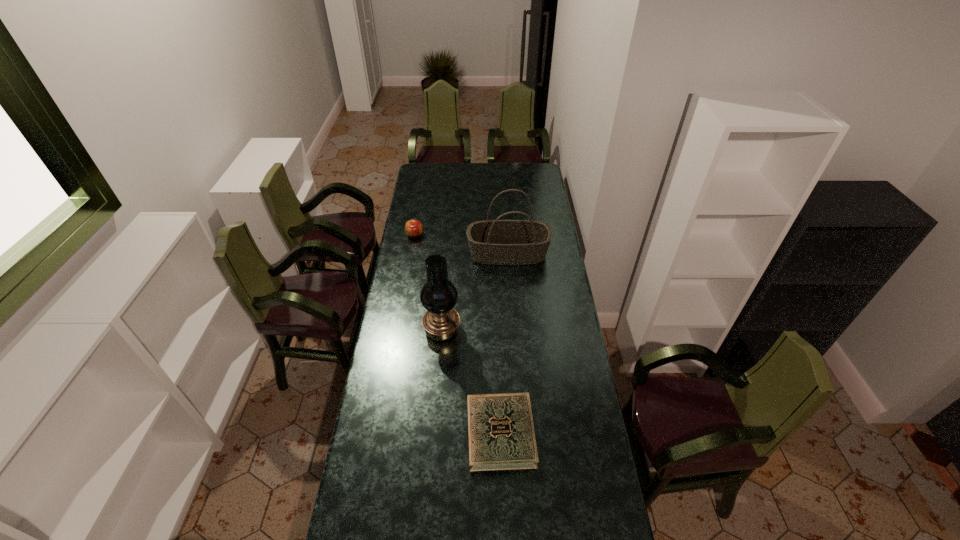
Where is `vacant space located on the right of the apple`? vacant space located on the right of the apple is located at coordinates (461, 235).

You are a GUI agent. You are given a task and a screenshot of the screen. Output one action in this format:
    pyautogui.click(x=<x>, y=<y>)
    Task: Click on the vacant region located 0.100m on the back of the hardback book
    
    Given the screenshot: What is the action you would take?
    pyautogui.click(x=498, y=376)

You are a GUI agent. You are given a task and a screenshot of the screen. Output one action in this format:
    pyautogui.click(x=<x>, y=<y>)
    Task: Click on the object present at the left edge
    The image size is (960, 540).
    Given the screenshot: What is the action you would take?
    pyautogui.click(x=413, y=228)

This screenshot has width=960, height=540. In order to click on object situated at the right edge in this screenshot , I will do `click(493, 242)`.

This screenshot has width=960, height=540. I want to click on free spot at the far edge of the desktop, so click(x=445, y=164).

In the image, there is a desktop. Where is `vacant space at the left edge`? The image size is (960, 540). vacant space at the left edge is located at coordinates point(408,410).

Identify the location of vacant space at the right edge of the desktop. The width and height of the screenshot is (960, 540). (x=547, y=207).

I want to click on vacant region at the far left corner of the desktop, so click(439, 168).

Identify the location of free area in between the tallest object and the nearest object. The image size is (960, 540). (471, 382).

You are a GUI agent. You are given a task and a screenshot of the screen. Output one action in this format:
    pyautogui.click(x=<x>, y=<y>)
    Task: Click on the free spot between the shortest object and the second tallest object
    
    Given the screenshot: What is the action you would take?
    pyautogui.click(x=504, y=343)